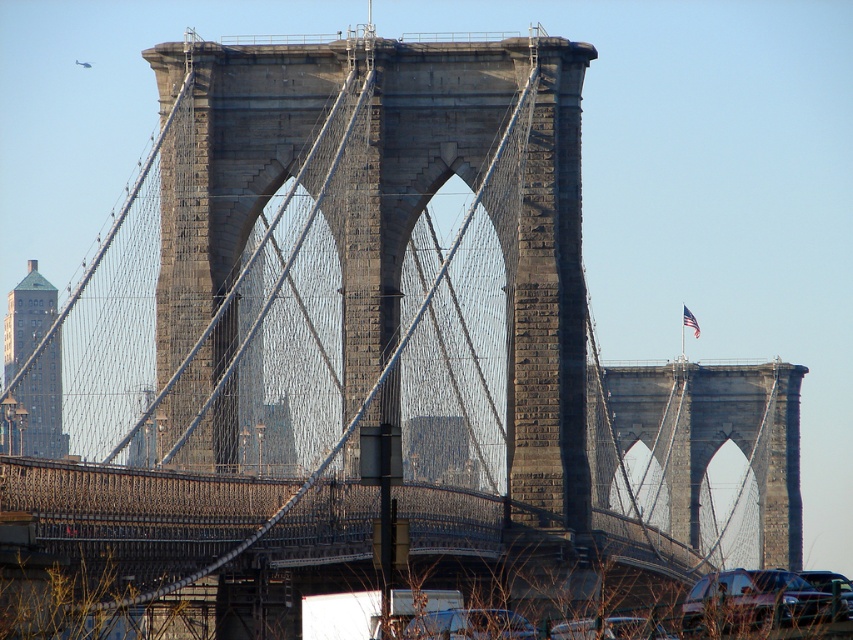
Question: Which object is farther from the camera taking this photo?

Choices:
 (A) shiny black sedan at lower right
 (B) shiny black car at lower center
 (C) metallic silver car at lower center

Answer: (C)

Question: Which of the following is the closest to the observer?

Choices:
 (A) metallic silver car at lower center
 (B) shiny black car at lower center

Answer: (B)

Question: Can you confirm if metallic silver car at lower center is bigger than shiny black car at lower center?

Choices:
 (A) no
 (B) yes

Answer: (B)

Question: Can you confirm if shiny black sedan at lower right is positioned below shiny black car at lower center?

Choices:
 (A) no
 (B) yes

Answer: (A)

Question: Is shiny black sedan at lower right below shiny black car at lower center?

Choices:
 (A) no
 (B) yes

Answer: (A)

Question: Which object is closer to the camera taking this photo?

Choices:
 (A) shiny black car at lower center
 (B) shiny black sedan at lower right
 (C) metallic silver car at lower center

Answer: (B)